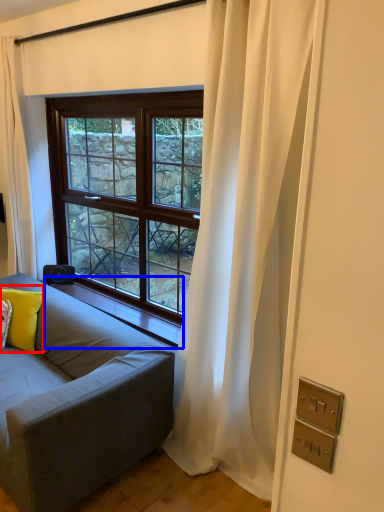
Question: Which point is closer to the camera, pillow (highlighted by a red box) or window sill (highlighted by a blue box)?

Choices:
 (A) pillow
 (B) window sill

Answer: (B)